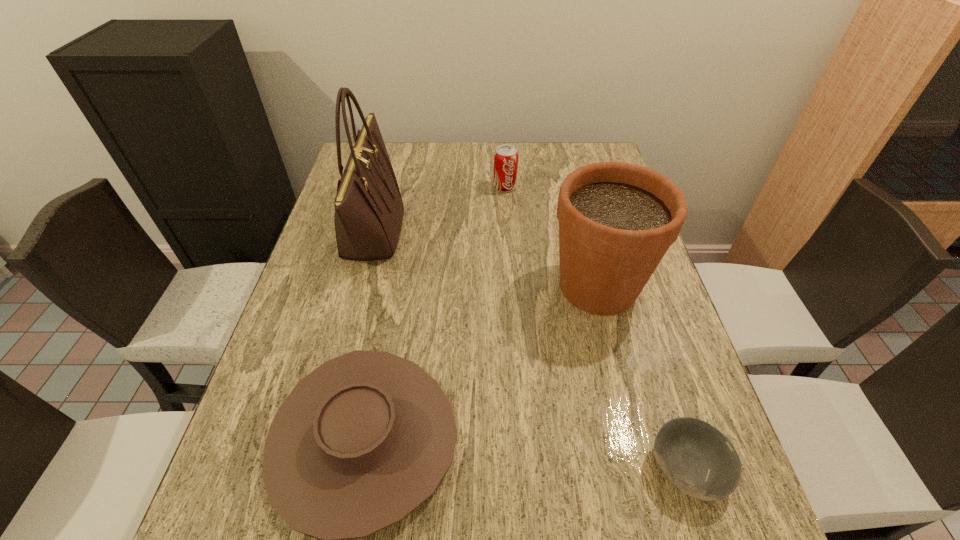
Locate which object is the closest to the handbag. Please provide its 2D coordinates. Your answer should be formatted as a tuple, i.e. [(x, y)], where the tuple contains the x and y coordinates of a point satisfying the conditions above.

[(362, 441)]

Select which object appears as the third closest to the fourth shortest object. Please provide its 2D coordinates. Your answer should be formatted as a tuple, i.e. [(x, y)], where the tuple contains the x and y coordinates of a point satisfying the conditions above.

[(506, 156)]

I want to click on free space that satisfies the following two spatial constraints: 1. on the front side of the flowerpot; 2. on the left side of the bowl, so click(x=644, y=468).

Find the location of a particular element. The width and height of the screenshot is (960, 540). vacant position in the image that satisfies the following two spatial constraints: 1. on the front-facing side of the handbag; 2. on the right side of the fourth shortest object is located at coordinates (358, 286).